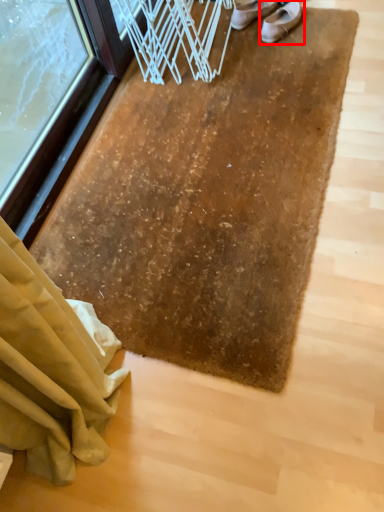
Question: Considering the relative positions of footwear (annotated by the red box) and footwear in the image provided, where is footwear (annotated by the red box) located with respect to the staircase?

Choices:
 (A) left
 (B) right

Answer: (B)